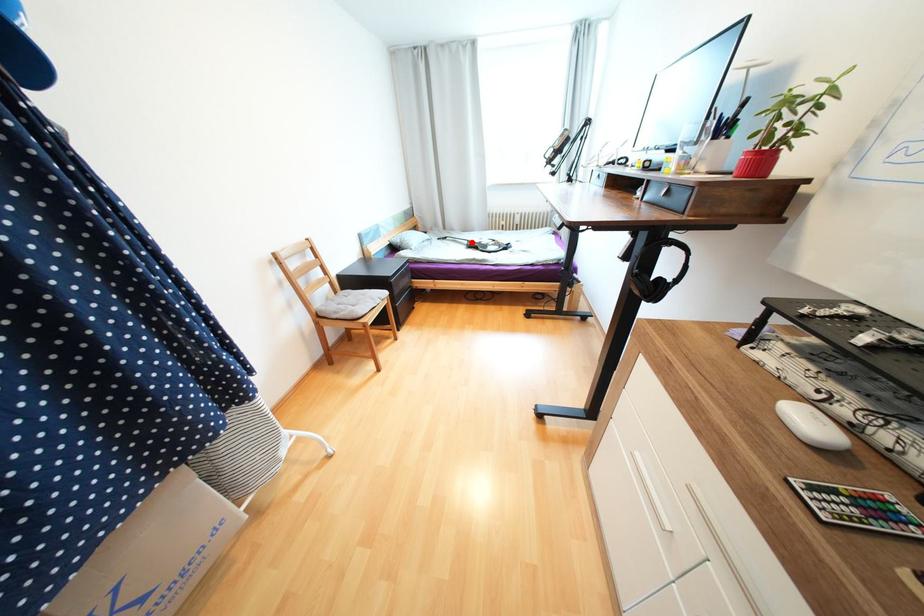
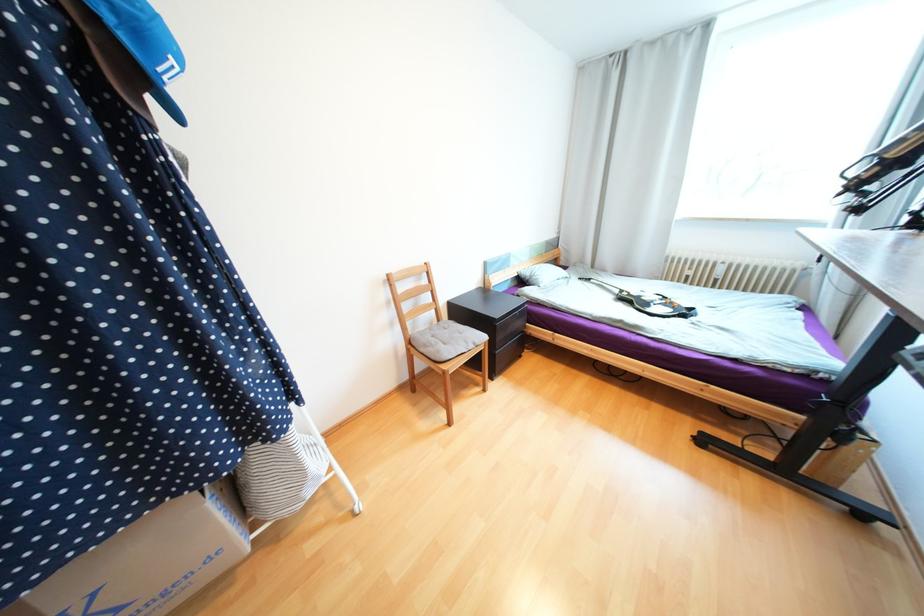
In the second image, find the point that corresponds to the highlighted location in the first image.

(623, 292)